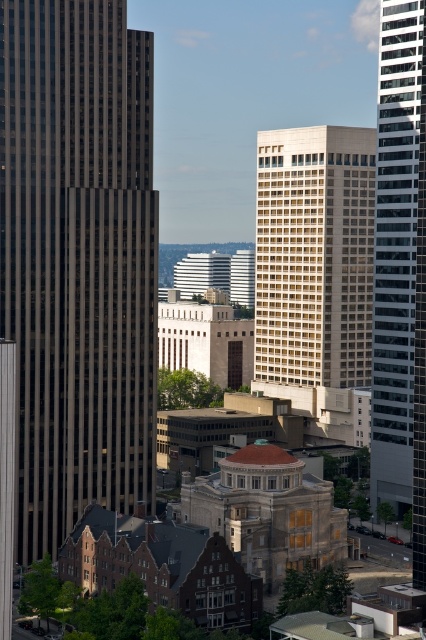
You are an urban planner assessing the city layout. You need to determine which of the two buildings, the white textured building at center or the glassy reflective skyscraper at right, has a larger footprint on the ground. Based on the scene, which one would you conclude?

The white textured building at center is bigger than the glassy reflective skyscraper at right, so it has a larger footprint on the ground.

You are standing in the middle of the city square, facing the skyline. You want to take a photo of the glassy reflective skyscraper at right without any obstructions. Is the dark glass skyscraper at left blocking your view of it?

The glassy reflective skyscraper at right is behind the dark glass skyscraper at left, so the dark glass skyscraper at left is blocking your view of the glassy reflective skyscraper at right.